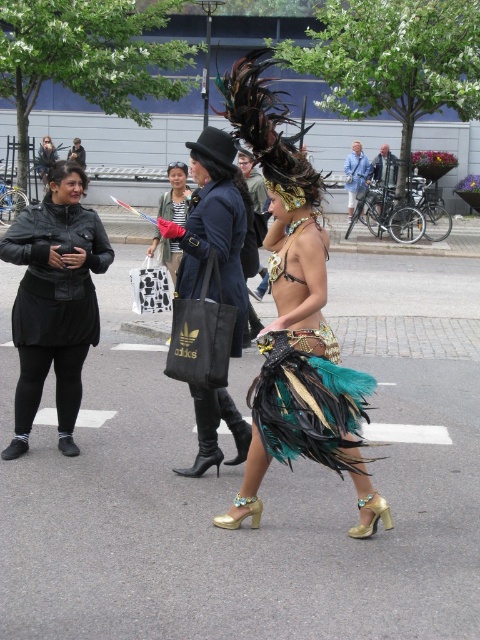
You are a fashion designer observing the street scene. You notice two jackets in the image. Which jacket, the black leather jacket at left or the matte black jacket at center, has a wider silhouette?

The black leather jacket at left has a wider silhouette than the matte black jacket at center according to the description.

From the picture: You are a photographer standing at the center of the street. You want to take a photo of the shiny black coat at center and the person in dark blue coat. How far apart are they in feet?

The shiny black coat at center and the person in dark blue coat are 14.39 feet apart.